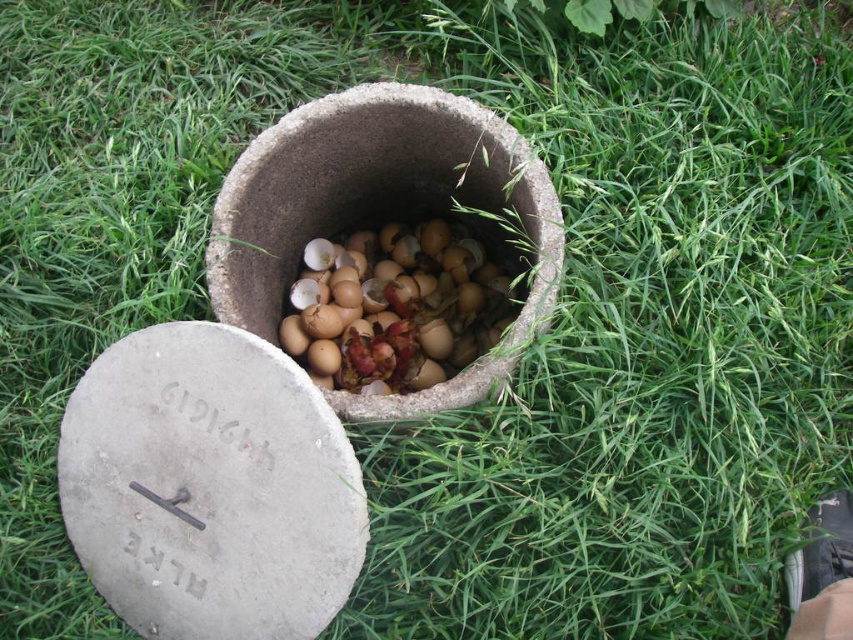
You are a gardener trying to store more eggshells in the container. You see the gray concrete lid at center and the brown matte eggshells at center. Which object should you move to make more space for the eggshells?

The gray concrete lid at center is smaller than the brown matte eggshells at center, so you should move the gray concrete lid at center to make more space for the eggshells.

Looking at this image, you are standing at a position where you can see both points labeled as point (300, 561) and point (496, 308) in the image. Which point is closer to you?

Point (300, 561) is in front of point (496, 308), so it is closer to you.